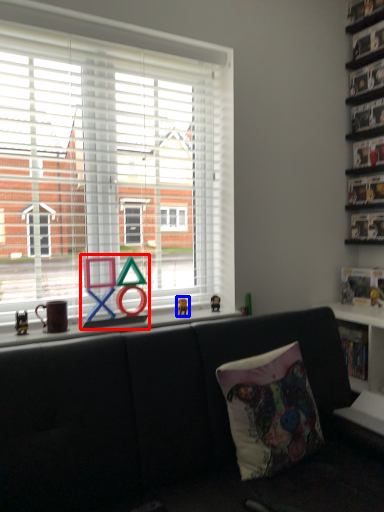
Question: Which of the following is the closest to the observer, toy (highlighted by a red box) or miniature (highlighted by a blue box)?

Choices:
 (A) toy
 (B) miniature

Answer: (A)